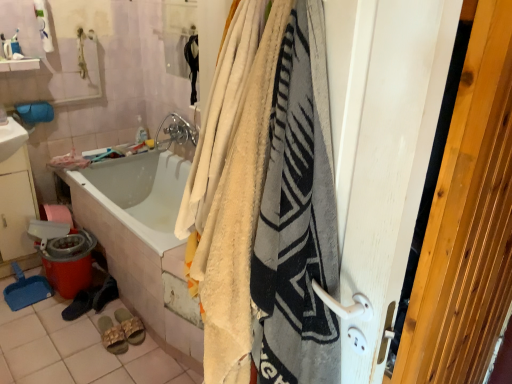
You are a GUI agent. You are given a task and a screenshot of the screen. Output one action in this format:
    pyautogui.click(x=<x>, y=<y>)
    Task: Click on the blank space to the left of beige fabric slipper at lower center, the fourth footwear in the left-to-right sequence
    This screenshot has width=512, height=384.
    Given the screenshot: What is the action you would take?
    pyautogui.click(x=86, y=332)